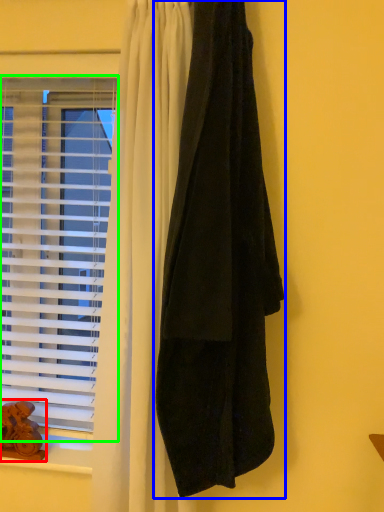
Question: Which is nearer to the animal (highlighted by a red box)? curtain (highlighted by a blue box) or window (highlighted by a green box).

Choices:
 (A) curtain
 (B) window

Answer: (B)